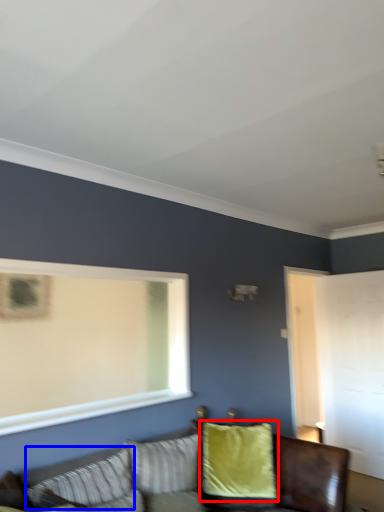
Question: Which object appears closest to the camera in this image, pillow (highlighted by a red box) or pillow (highlighted by a blue box)?

Choices:
 (A) pillow
 (B) pillow

Answer: (B)